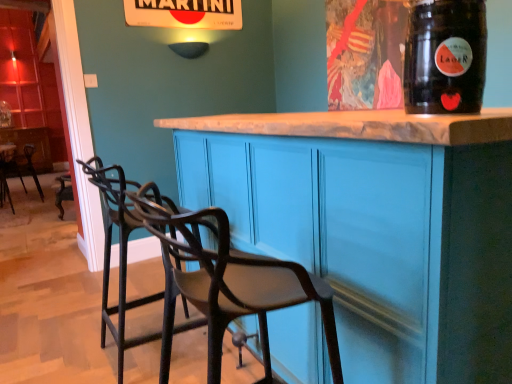
Question: Considering the relative sizes of brushed metal table at left and black metal chair at left, which is the 1th chair in back-to-front order, in the image provided, is brushed metal table at left shorter than black metal chair at left, which is the 1th chair in back-to-front order,?

Choices:
 (A) yes
 (B) no

Answer: (B)

Question: Does brushed metal table at left have a lesser width compared to black metal chair at left, the first chair when ordered from left to right?

Choices:
 (A) no
 (B) yes

Answer: (A)

Question: Does brushed metal table at left lie behind black metal chair at left, which is the 1th chair in back-to-front order?

Choices:
 (A) yes
 (B) no

Answer: (B)

Question: From the image's perspective, is brushed metal table at left below black metal chair at left, which appears as the third chair when viewed from the right?

Choices:
 (A) no
 (B) yes

Answer: (B)

Question: Can you confirm if brushed metal table at left is bigger than black metal chair at left, which is the 1th chair in back-to-front order?

Choices:
 (A) yes
 (B) no

Answer: (B)

Question: Is brushed metal table at left not within black metal chair at left, which appears as the third chair when viewed from the right?

Choices:
 (A) yes
 (B) no

Answer: (A)

Question: Is matte black chair at center, acting as the 3th chair starting from the back, wider than black metal bar stool at lower left, positioned as the second chair in back-to-front order?

Choices:
 (A) no
 (B) yes

Answer: (B)

Question: Can you confirm if matte black chair at center, which ranks as the 1th chair in front-to-back order, is taller than black metal bar stool at lower left, which is the second chair in right-to-left order?

Choices:
 (A) no
 (B) yes

Answer: (A)

Question: From a real-world perspective, does matte black chair at center, acting as the 3th chair starting from the back, stand above black metal bar stool at lower left, positioned as the second chair in back-to-front order?

Choices:
 (A) no
 (B) yes

Answer: (B)

Question: Is matte black chair at center, which ranks as the 1th chair in front-to-back order, further to camera compared to black metal bar stool at lower left, acting as the second chair starting from the left?

Choices:
 (A) yes
 (B) no

Answer: (B)

Question: Can you confirm if matte black chair at center, which is counted as the 1th chair, starting from the right, is positioned to the right of black metal bar stool at lower left, positioned as the second chair in back-to-front order?

Choices:
 (A) yes
 (B) no

Answer: (A)

Question: Can you confirm if matte black chair at center, which is counted as the 1th chair, starting from the right, is shorter than black metal bar stool at lower left, which is counted as the 2th chair, starting from the front?

Choices:
 (A) yes
 (B) no

Answer: (A)

Question: Is black metal bar stool at lower left, which is the second chair in right-to-left order, not close to transparent plastic straw at upper right?

Choices:
 (A) yes
 (B) no

Answer: (A)